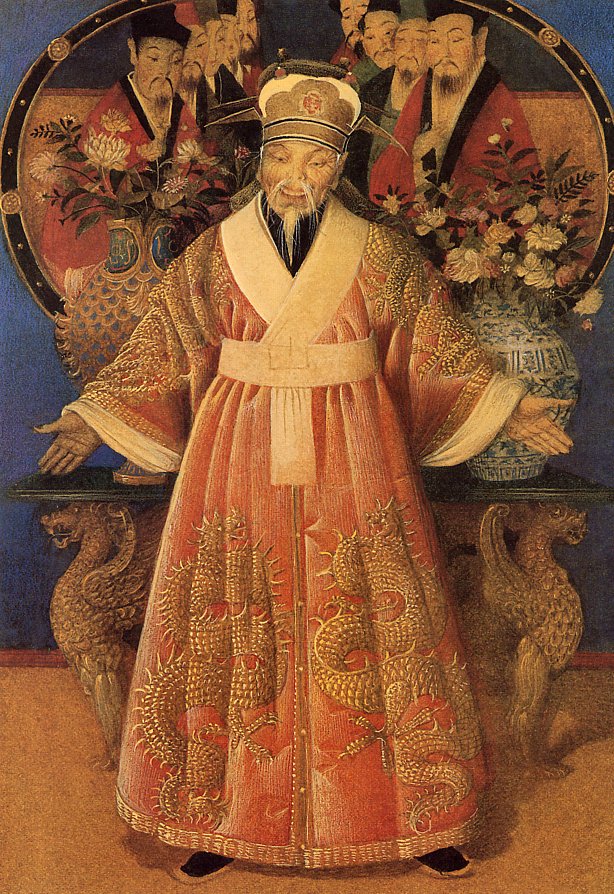
The width and height of the screenshot is (614, 894). I want to click on table, so click(126, 488).